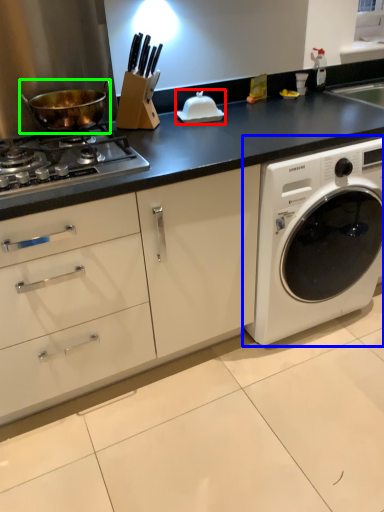
Question: Which object is the farthest from appliance (highlighted by a red box)? Choose among these: washing machine (highlighted by a blue box) or wok (highlighted by a green box).

Choices:
 (A) washing machine
 (B) wok

Answer: (A)